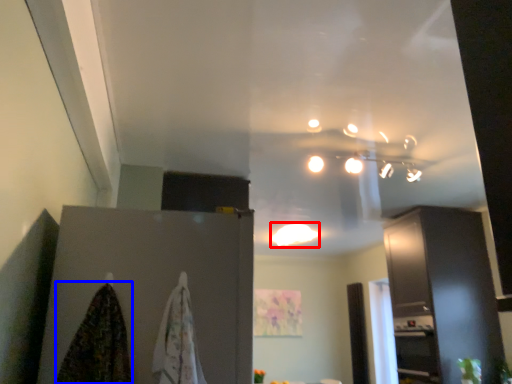
Question: Which object appears farthest to the camera in this image, lighting (highlighted by a red box) or blanket (highlighted by a blue box)?

Choices:
 (A) lighting
 (B) blanket

Answer: (A)